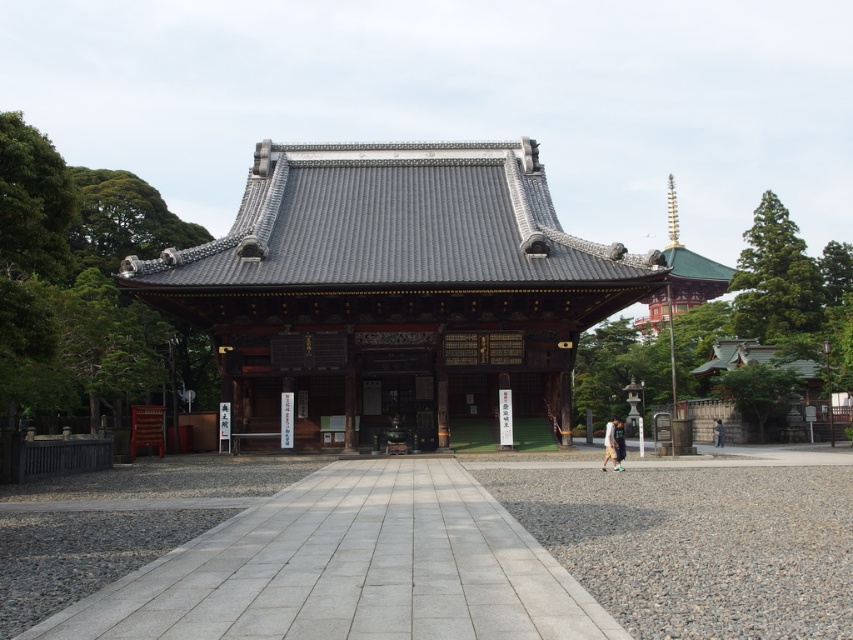
Does light brown fabric pants at center appear on the right side of dark gray fabric jacket at center?

Incorrect, light brown fabric pants at center is not on the right side of dark gray fabric jacket at center.

Does light brown fabric pants at center lie in front of dark gray fabric jacket at center?

Yes.

Is point (618, 448) in front of point (715, 438)?

Yes, point (618, 448) is closer to viewer.

Identify the location of light brown fabric pants at center. (611, 444).

Who is positioned more to the left, gray gravel at lower center or light brown fabric pants at center?

Positioned to the left is gray gravel at lower center.

Looking at this image, is gray gravel at lower center taller than light brown fabric pants at center?

No, gray gravel at lower center is not taller than light brown fabric pants at center.

Between point (769, 577) and point (607, 436), which one is positioned in front?

Positioned in front is point (769, 577).

The width and height of the screenshot is (853, 640). I want to click on gray gravel at lower center, so click(x=697, y=545).

Who is lower down, shiny dark gray temple at center or gray gravel at lower center?

gray gravel at lower center is lower down.

Can you confirm if shiny dark gray temple at center is bigger than gray gravel at lower center?

Yes.

Between point (506, 220) and point (773, 573), which one is positioned behind?

The point (506, 220) is behind.

The image size is (853, 640). In order to click on shiny dark gray temple at center in this screenshot , I will do `click(393, 289)`.